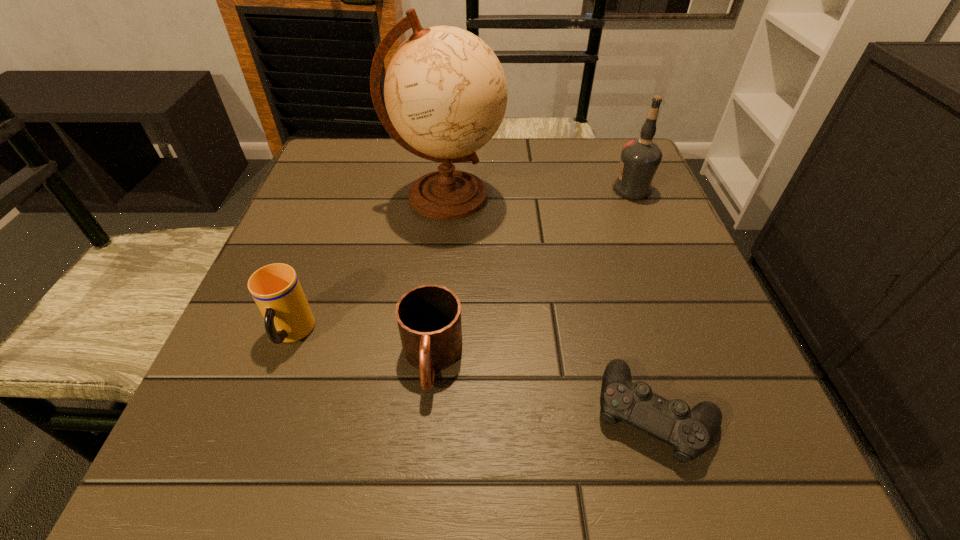
The height and width of the screenshot is (540, 960). I want to click on vacant space located 0.100m on the side of the leftmost object with the handle, so click(260, 421).

Locate an element on the screen. Image resolution: width=960 pixels, height=540 pixels. vacant space located on the back of the control is located at coordinates (603, 237).

Locate an element on the screen. This screenshot has height=540, width=960. globe that is at the far edge is located at coordinates (445, 91).

You are a GUI agent. You are given a task and a screenshot of the screen. Output one action in this format:
    pyautogui.click(x=<x>, y=<y>)
    Task: Click on the vodka that is at the far edge
    Image resolution: width=960 pixels, height=540 pixels.
    Given the screenshot: What is the action you would take?
    pyautogui.click(x=640, y=158)

Image resolution: width=960 pixels, height=540 pixels. In order to click on object that is at the near edge in this screenshot , I will do `click(689, 431)`.

Where is `object present at the left edge`? This screenshot has height=540, width=960. object present at the left edge is located at coordinates (275, 288).

The height and width of the screenshot is (540, 960). Identify the location of vodka positioned at the right edge. (640, 158).

The height and width of the screenshot is (540, 960). I want to click on control that is at the right edge, so click(689, 431).

Locate an element on the screen. The image size is (960, 540). object positioned at the far right corner is located at coordinates (640, 158).

Where is `object present at the near right corner`? The width and height of the screenshot is (960, 540). object present at the near right corner is located at coordinates (689, 431).